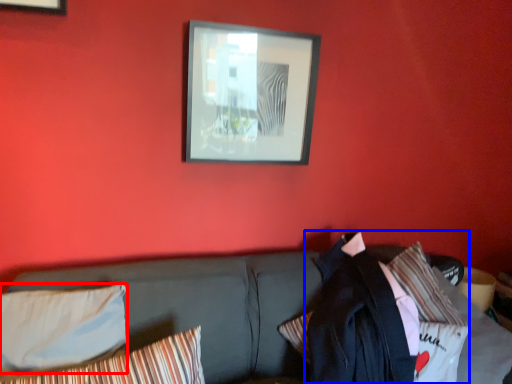
Question: Which of the following is the farthest to the observer, pillow (highlighted by a red box) or jacket (highlighted by a blue box)?

Choices:
 (A) pillow
 (B) jacket

Answer: (B)